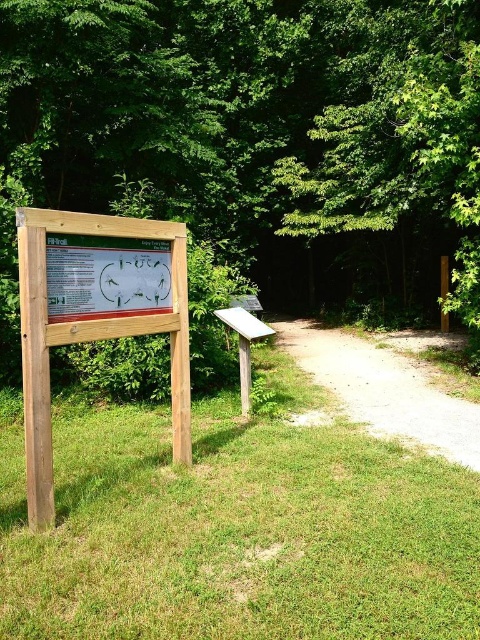
The height and width of the screenshot is (640, 480). Describe the element at coordinates (259, 131) in the screenshot. I see `green leafy tree at upper center` at that location.

Where is `green leafy tree at upper center`? The image size is (480, 640). green leafy tree at upper center is located at coordinates (259, 131).

Can you confirm if wooden sign at center is bigger than dirt path at center?

Incorrect, wooden sign at center is not larger than dirt path at center.

Is wooden sign at center to the right of dirt path at center from the viewer's perspective?

No, wooden sign at center is not to the right of dirt path at center.

Where is `wooden sign at center`? Image resolution: width=480 pixels, height=640 pixels. wooden sign at center is located at coordinates pyautogui.click(x=95, y=314).

Is green grass at lower left positioned in front of wooden sign at center?

Yes, it is in front of wooden sign at center.

Does green grass at lower left appear under wooden sign at center?

Yes, green grass at lower left is below wooden sign at center.

Does point (395, 588) come behind point (72, 301)?

That is False.

Locate an element on the screen. The height and width of the screenshot is (640, 480). green grass at lower left is located at coordinates (238, 532).